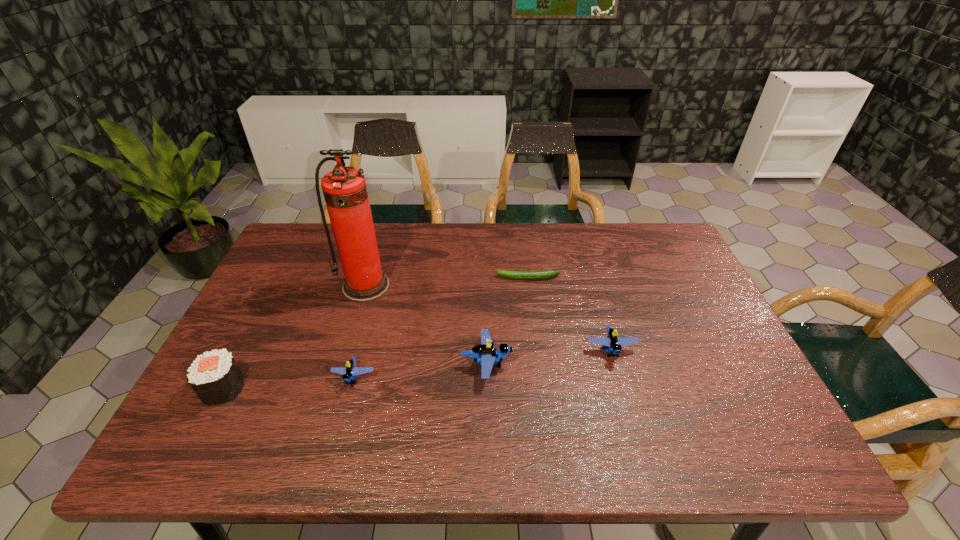
Identify the location of the fifth tallest object. (349, 372).

Where is `the shortest Lego`? The width and height of the screenshot is (960, 540). the shortest Lego is located at coordinates pos(349,372).

Identify the location of the second Lego from right to left. (486, 353).

Where is `the third shortest object`? This screenshot has width=960, height=540. the third shortest object is located at coordinates pos(612,342).

The width and height of the screenshot is (960, 540). I want to click on the rightmost Lego, so click(x=612, y=342).

Find the location of a particular element. The height and width of the screenshot is (540, 960). the tallest object is located at coordinates (345, 192).

Where is `the shortest object`? This screenshot has height=540, width=960. the shortest object is located at coordinates (528, 275).

Find the location of a particular element. This screenshot has width=960, height=540. the leftmost object is located at coordinates (215, 377).

At what (x,y) coordinates should I click in order to perform the action: click on vacant area situated on the front-facing side of the tallest Lego. Please return your answer as a coordinate pair (x, y). Looking at the image, I should click on (669, 363).

I want to click on vacant position located on the front-facing side of the rightmost Lego, so click(628, 409).